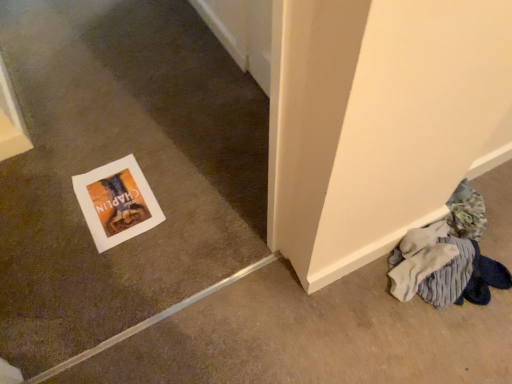
Describe the element at coordinates (117, 202) in the screenshot. I see `matte paper postcard at lower left` at that location.

You are a GUI agent. You are given a task and a screenshot of the screen. Output one action in this format:
    pyautogui.click(x=<x>, y=<y>)
    Task: Click on the matte paper postcard at lower left
    
    Given the screenshot: What is the action you would take?
    pyautogui.click(x=117, y=202)

I want to click on matte paper postcard at lower left, so click(x=117, y=202).